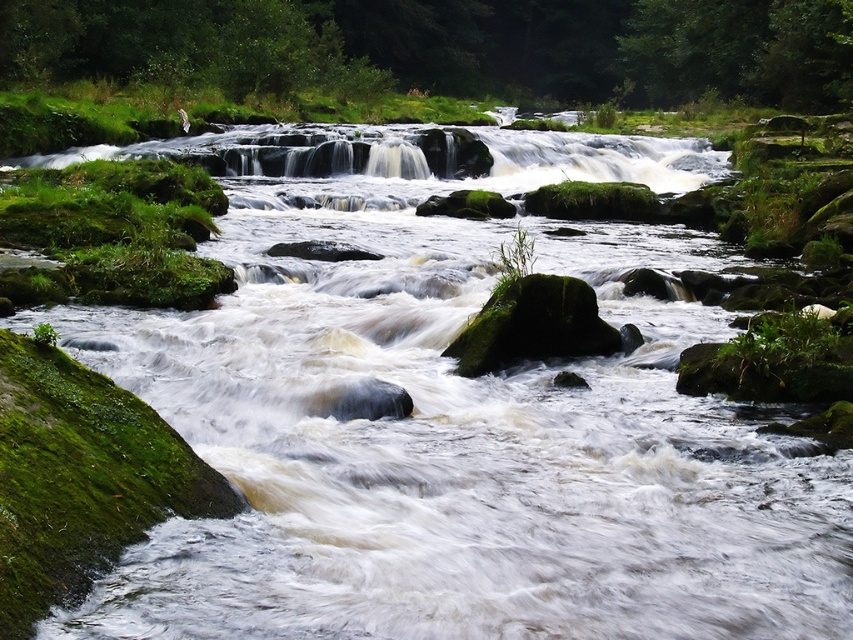
Question: Among these points, which one is farthest from the camera?

Choices:
 (A) pyautogui.click(x=479, y=346)
 (B) pyautogui.click(x=602, y=64)

Answer: (B)

Question: Which point is farther to the camera?

Choices:
 (A) green mossy rock at center
 (B) green mossy rocks at center

Answer: (B)

Question: Is green mossy rocks at center positioned at the back of green mossy rock at center?

Choices:
 (A) yes
 (B) no

Answer: (A)

Question: Considering the relative positions of green mossy rocks at center and green mossy rock at center in the image provided, where is green mossy rocks at center located with respect to green mossy rock at center?

Choices:
 (A) above
 (B) below

Answer: (A)

Question: Is green mossy rocks at center below green mossy rock at center?

Choices:
 (A) no
 (B) yes

Answer: (A)